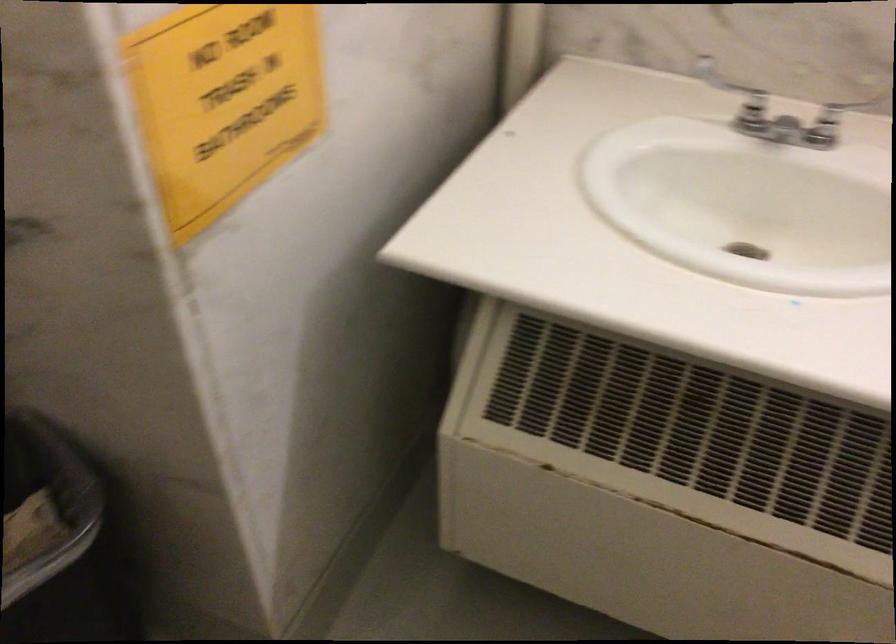
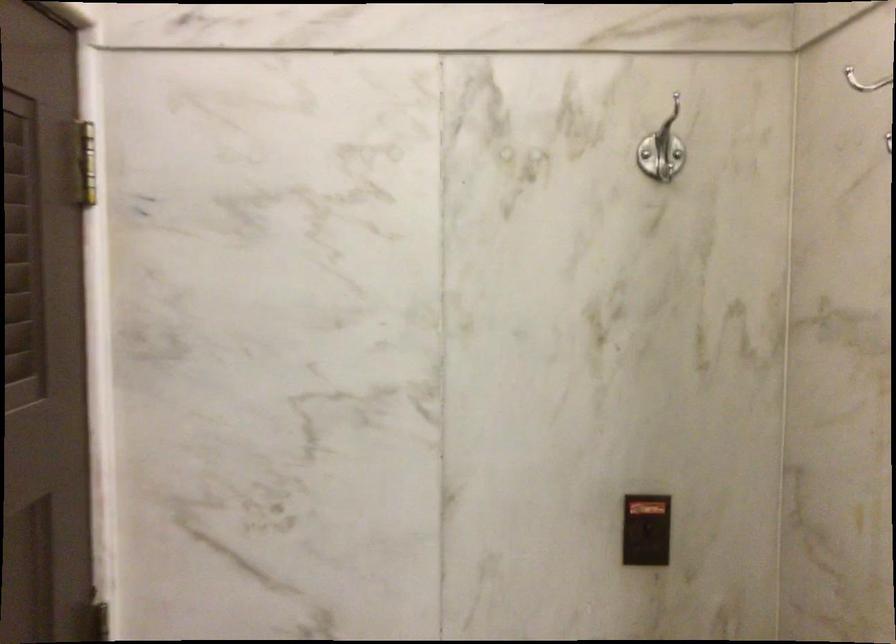
Question: How did the camera likely rotate?

Choices:
 (A) Left
 (B) Right
 (C) Up
 (D) Down

Answer: (A)